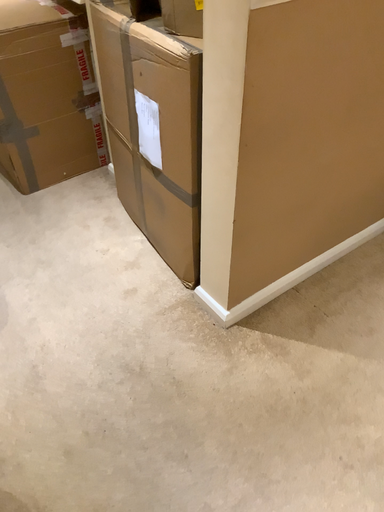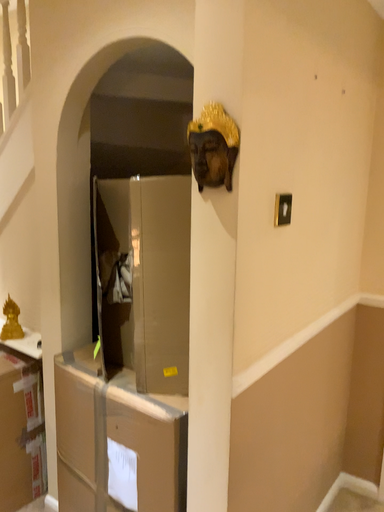
Question: Which way did the camera rotate in the video?

Choices:
 (A) rotated downward
 (B) rotated upward

Answer: (B)